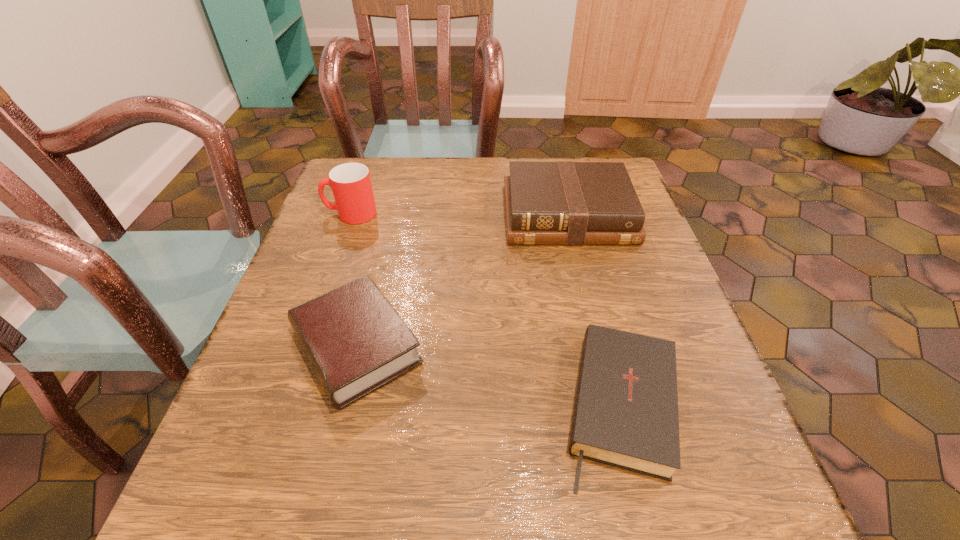
This screenshot has height=540, width=960. Find the location of `cup`. cup is located at coordinates coord(350,182).

Where is `the farthest Bible`? The width and height of the screenshot is (960, 540). the farthest Bible is located at coordinates point(546,203).

This screenshot has width=960, height=540. In order to click on the third shortest object in this screenshot , I will do `click(546, 203)`.

Where is `the second shortest object`? The image size is (960, 540). the second shortest object is located at coordinates (356, 342).

This screenshot has width=960, height=540. In order to click on the second shortest Bible in this screenshot , I will do `click(356, 342)`.

The width and height of the screenshot is (960, 540). What are the coordinates of `the shortest Bible` in the screenshot? It's located at (625, 415).

You are a GUI agent. You are given a task and a screenshot of the screen. Output one action in this format:
    pyautogui.click(x=<x>, y=<y>)
    Task: Click on the vacant space located 0.250m on the spine side of the second tallest object
    The image size is (960, 540).
    Given the screenshot: What is the action you would take?
    pyautogui.click(x=597, y=339)

You are a GUI agent. You are given a task and a screenshot of the screen. Output one action in this format:
    pyautogui.click(x=<x>, y=<y>)
    Task: Click on the free spot located on the right of the second tallest Bible
    
    Given the screenshot: What is the action you would take?
    pyautogui.click(x=483, y=347)

Locate an element on the screen. The height and width of the screenshot is (540, 960). free space located 0.320m on the back of the shortest object is located at coordinates (577, 228).

Identify the location of cup at the far edge. (350, 182).